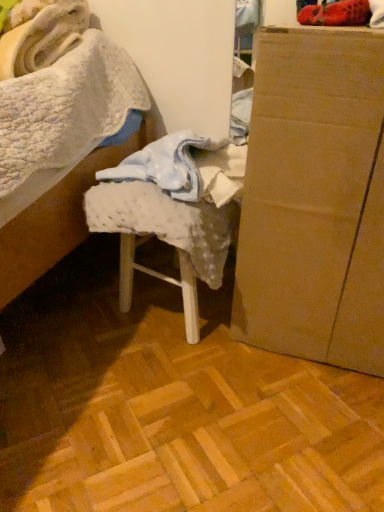
Question: From a real-world perspective, is cardboard box at right physically located above or below white textured fabric at center?

Choices:
 (A) above
 (B) below

Answer: (A)

Question: Considering the positions of point (278, 349) and point (187, 224), is point (278, 349) closer or farther from the camera than point (187, 224)?

Choices:
 (A) closer
 (B) farther

Answer: (B)

Question: Is cardboard box at right taller or shorter than white textured fabric at center?

Choices:
 (A) short
 (B) tall

Answer: (B)

Question: From a real-world perspective, relative to cardboard box at right, is white textured fabric at center vertically above or below?

Choices:
 (A) above
 (B) below

Answer: (B)

Question: Do you think white textured fabric at center is within cardboard box at right, or outside of it?

Choices:
 (A) outside
 (B) inside

Answer: (A)

Question: Is white textured fabric at center to the left or to the right of cardboard box at right in the image?

Choices:
 (A) right
 (B) left

Answer: (B)

Question: Looking at their shapes, would you say white textured fabric at center is wider or thinner than cardboard box at right?

Choices:
 (A) thin
 (B) wide

Answer: (A)